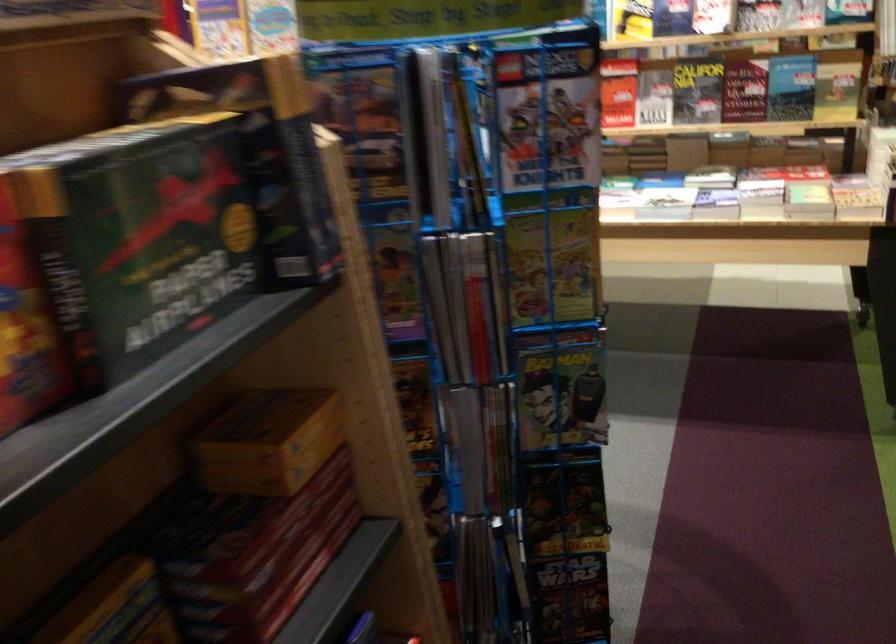
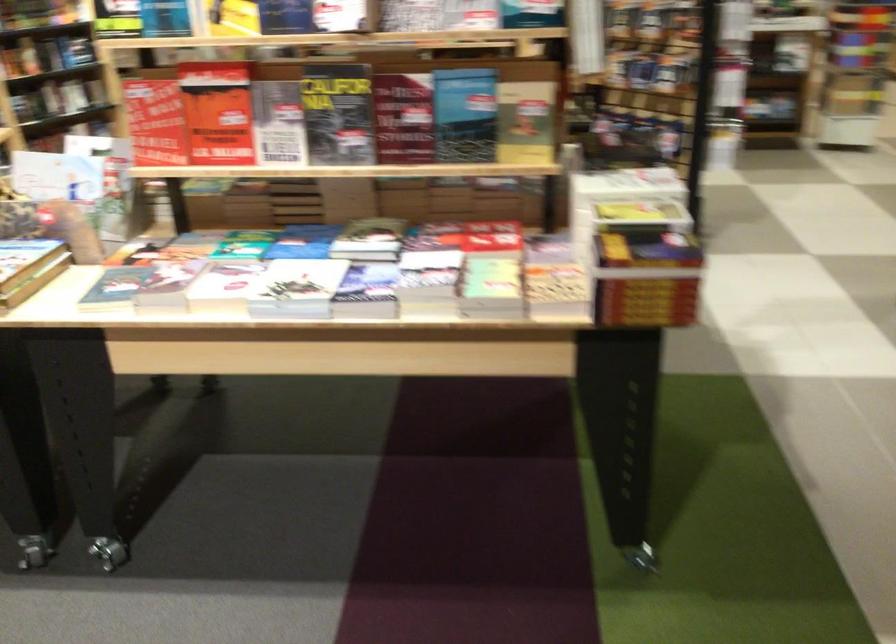
Locate, in the second image, the point that corresponds to pixel 660 88 in the first image.

(279, 122)